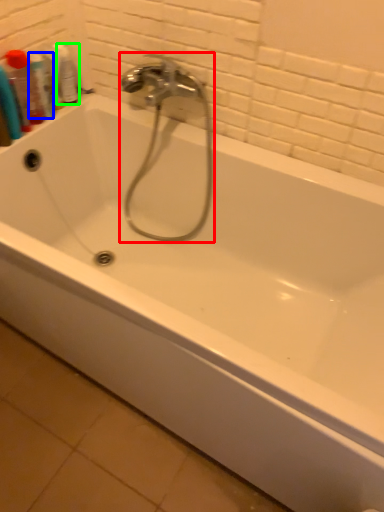
Question: Based on their relative distances, which object is nearer to faucet (highlighted by a red box)? Choose from mouthwash (highlighted by a blue box) and mouthwash (highlighted by a green box).

Choices:
 (A) mouthwash
 (B) mouthwash

Answer: (B)